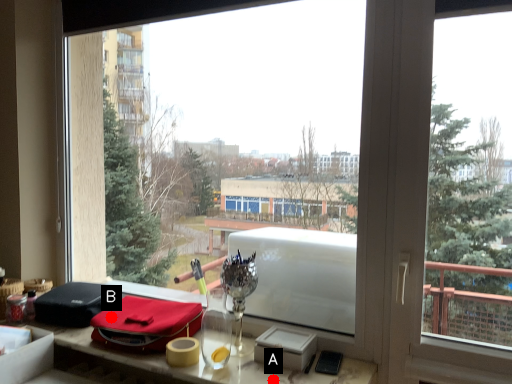
Question: Two points are circled on the image, labeled by A and B beside each circle. Which point appears farthest from the camera in this image?

Choices:
 (A) A is further
 (B) B is further

Answer: (B)